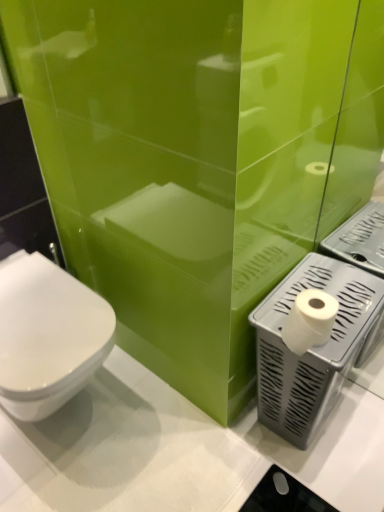
This screenshot has height=512, width=384. I want to click on blank space situated above gray plastic toilet paper holder at lower right (from a real-world perspective), so click(x=342, y=291).